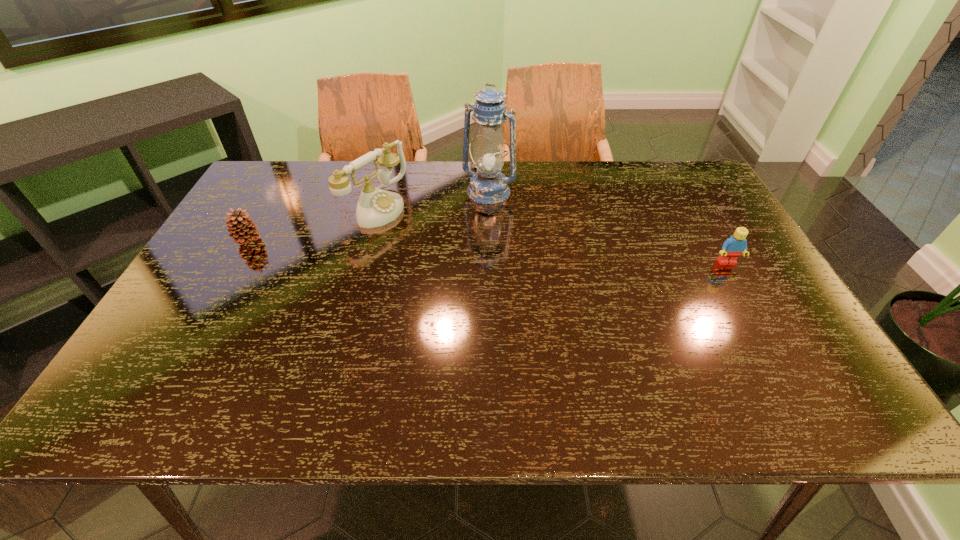
Identify the location of vacant region at the far edge of the desktop. 418,174.

In the image, there is a desktop. Where is `vacant space at the near edge`? This screenshot has width=960, height=540. vacant space at the near edge is located at coordinates (308, 360).

Find the location of a particular element. The image size is (960, 540). free point at the left edge is located at coordinates [x=252, y=287].

At what (x,y) coordinates should I click in order to perform the action: click on free space at the right edge of the desktop. Please return your answer as a coordinate pair (x, y). Looking at the image, I should click on (706, 256).

The width and height of the screenshot is (960, 540). I want to click on vacant space at the far left corner of the desktop, so click(x=294, y=183).

Find the location of a particular element. free space at the far right corner of the desktop is located at coordinates (664, 166).

Where is `vacant region between the Lego and the leftmost object`? Image resolution: width=960 pixels, height=540 pixels. vacant region between the Lego and the leftmost object is located at coordinates (488, 251).

What are the coordinates of `blank region between the leftmost object and the third object from right to left` in the screenshot? It's located at [x=312, y=224].

Locate an element on the screen. free spot between the rightmost object and the lantern is located at coordinates (608, 227).

Find the location of a particular element. The width and height of the screenshot is (960, 540). vacant space that's between the leftmost object and the Lego is located at coordinates (488, 251).